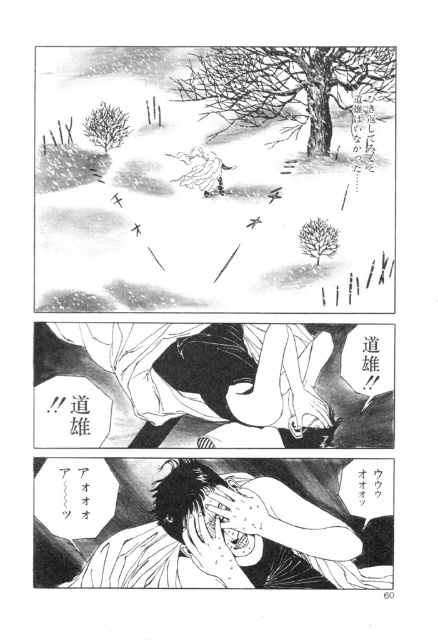
Question: Which of the following is the closest to the observer?

Choices:
 (A) white paper at lower center
 (B) smooth black hair at center

Answer: (A)

Question: Is white fluffy snow at center further to the viewer compared to smooth black hair at center?

Choices:
 (A) no
 (B) yes

Answer: (A)

Question: Which of the following is the farthest from the observer?

Choices:
 (A) (194, 563)
 (B) (122, 58)
 (C) (297, 323)

Answer: (C)

Question: Does white fluffy snow at center lie in front of white paper at lower center?

Choices:
 (A) no
 (B) yes

Answer: (B)

Question: Estimate the real-world distances between objects in this image. Which object is farther from the white paper at lower center?

Choices:
 (A) white fluffy snow at center
 (B) smooth black hair at center

Answer: (A)

Question: Observing the image, what is the correct spatial positioning of smooth black hair at center in reference to white paper at lower center?

Choices:
 (A) right
 (B) left

Answer: (B)